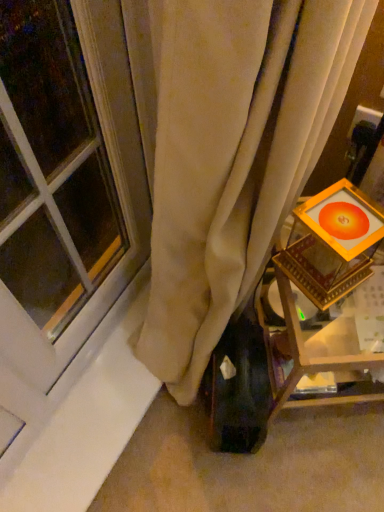
This screenshot has width=384, height=512. I want to click on matte glass window at left, so click(x=65, y=179).

Describe the element at coordinates (65, 179) in the screenshot. I see `matte glass window at left` at that location.

What do you see at coordinates (308, 349) in the screenshot? I see `wooden framed picture at right` at bounding box center [308, 349].

At what (x,y) coordinates should I click in order to perform the action: click on wooden framed picture at right. Please return your answer as a coordinate pair (x, y). Looking at the image, I should click on (308, 349).

This screenshot has height=512, width=384. Identify the location of matte glass window at left. (65, 179).

Based on their positions, is wooden framed picture at right located to the left or right of matte glass window at left?

Based on their positions, wooden framed picture at right is located to the right of matte glass window at left.

Is the position of wooden framed picture at right more distant than that of matte glass window at left?

Yes, wooden framed picture at right is further from the viewer.

Is point (265, 338) closer to camera compared to point (95, 173)?

That is True.

From the image's perspective, which object appears higher, wooden framed picture at right or matte glass window at left?

matte glass window at left, from the image's perspective.

From a real-world perspective, is wooden framed picture at right located higher than matte glass window at left?

No, from a real-world perspective, wooden framed picture at right is not above matte glass window at left.

Which object is wider, wooden framed picture at right or matte glass window at left?

wooden framed picture at right is wider.

Considering the sizes of wooden framed picture at right and matte glass window at left in the image, is wooden framed picture at right taller or shorter than matte glass window at left?

Considering their sizes, wooden framed picture at right has less height than matte glass window at left.

Is wooden framed picture at right bigger or smaller than matte glass window at left?

In the image, wooden framed picture at right appears to be larger than matte glass window at left.

In the scene shown: Is wooden framed picture at right inside the boundaries of matte glass window at left, or outside?

wooden framed picture at right is outside matte glass window at left.

Is wooden framed picture at right not close to matte glass window at left?

No, wooden framed picture at right is not far away from matte glass window at left.

Is wooden framed picture at right facing towards matte glass window at left?

No, wooden framed picture at right is not facing towards matte glass window at left.

Can you tell me how much wooden framed picture at right and matte glass window at left differ in facing direction?

wooden framed picture at right and matte glass window at left are facing 56.2 degrees away from each other.

Find the location of a particular element. The height and width of the screenshot is (512, 384). furniture below the matte glass window at left (from the image's perspective) is located at coordinates (308, 349).

Considering the relative positions of matte glass window at left and wooden framed picture at right in the image provided, is matte glass window at left to the right of wooden framed picture at right from the viewer's perspective?

No, matte glass window at left is not to the right of wooden framed picture at right.

Relative to wooden framed picture at right, is matte glass window at left in front or behind?

matte glass window at left is positioned closer to the viewer than wooden framed picture at right.

Does point (12, 32) come behind point (344, 323)?

That is False.

From the image's perspective, is matte glass window at left on wooden framed picture at right?

Yes, from the image's perspective, matte glass window at left is over wooden framed picture at right.

Looking at this image, from a real-world perspective, who is located higher, matte glass window at left or wooden framed picture at right?

In real-world perspective, matte glass window at left is above.

Between matte glass window at left and wooden framed picture at right, which one has smaller width?

Thinner between the two is matte glass window at left.

Considering the relative sizes of matte glass window at left and wooden framed picture at right in the image provided, is matte glass window at left shorter than wooden framed picture at right?

No, matte glass window at left is not shorter than wooden framed picture at right.

Between matte glass window at left and wooden framed picture at right, which one has larger size?

With larger size is wooden framed picture at right.

Do you think matte glass window at left is within wooden framed picture at right, or outside of it?

matte glass window at left is outside wooden framed picture at right.

Is matte glass window at left not close to wooden framed picture at right?

No, there isn't a large distance between matte glass window at left and wooden framed picture at right.

Is wooden framed picture at right at the back of matte glass window at left?

That's not correct — matte glass window at left is not looking away from wooden framed picture at right.

In the scene shown: How different are the orientations of matte glass window at left and wooden framed picture at right in degrees?

56.2 degrees.

Find the location of `window on the left of wooden framed picture at right`. window on the left of wooden framed picture at right is located at coordinates (65, 179).

At what (x,y) coordinates should I click in order to perform the action: click on window above the wooden framed picture at right (from the image's perspective). Please return your answer as a coordinate pair (x, y). Image resolution: width=384 pixels, height=512 pixels. Looking at the image, I should click on (x=65, y=179).

The image size is (384, 512). Find the location of `window positioned vertically above the wooden framed picture at right (from a real-world perspective)`. window positioned vertically above the wooden framed picture at right (from a real-world perspective) is located at coordinates (65, 179).